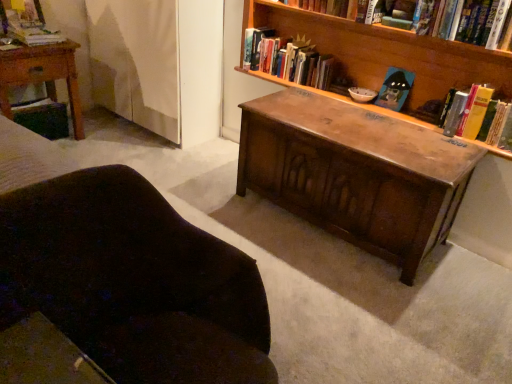
Question: Considering the relative sizes of yellow paperback book at right, the first book when ordered from right to left, and yellow hardcover book at right, the 5th book positioned from the left, in the image provided, is yellow paperback book at right, the first book when ordered from right to left, thinner than yellow hardcover book at right, the 5th book positioned from the left,?

Choices:
 (A) no
 (B) yes

Answer: (B)

Question: Is yellow paperback book at right, the first book when ordered from right to left, surrounding yellow hardcover book at right, the 5th book positioned from the left?

Choices:
 (A) yes
 (B) no

Answer: (B)

Question: Considering the relative positions of yellow paperback book at right, the first book when ordered from right to left, and yellow hardcover book at right, the 5th book positioned from the left, in the image provided, is yellow paperback book at right, the first book when ordered from right to left, to the left of yellow hardcover book at right, the 5th book positioned from the left, from the viewer's perspective?

Choices:
 (A) yes
 (B) no

Answer: (B)

Question: Does yellow paperback book at right, the first book when ordered from right to left, touch yellow hardcover book at right, which is counted as the second book, starting from the right?

Choices:
 (A) yes
 (B) no

Answer: (A)

Question: From a real-world perspective, is yellow paperback book at right, the 6th book positioned from the left, beneath yellow hardcover book at right, which is counted as the second book, starting from the right?

Choices:
 (A) no
 (B) yes

Answer: (A)

Question: Is wooden bookshelf at upper center, which is the 2th book in left-to-right order, inside or outside of yellow paperback book at right, the first book when ordered from right to left?

Choices:
 (A) inside
 (B) outside

Answer: (B)

Question: From a real-world perspective, is wooden bookshelf at upper center, positioned as the 5th book in right-to-left order, positioned above or below yellow paperback book at right, the 6th book positioned from the left?

Choices:
 (A) above
 (B) below

Answer: (B)

Question: Considering the positions of wooden bookshelf at upper center, positioned as the 5th book in right-to-left order, and yellow paperback book at right, the first book when ordered from right to left, in the image, is wooden bookshelf at upper center, positioned as the 5th book in right-to-left order, wider or thinner than yellow paperback book at right, the first book when ordered from right to left,?

Choices:
 (A) wide
 (B) thin

Answer: (B)

Question: Relative to yellow paperback book at right, the first book when ordered from right to left, is wooden bookshelf at upper center, which is the 2th book in left-to-right order, in front or behind?

Choices:
 (A) front
 (B) behind

Answer: (B)

Question: Considering the positions of point click(28, 23) and point click(366, 49), is point click(28, 23) closer or farther from the camera than point click(366, 49)?

Choices:
 (A) farther
 (B) closer

Answer: (A)

Question: Relative to wooden bookcase at center, is hardcover book at upper left, the 6th book positioned from the right, in front or behind?

Choices:
 (A) front
 (B) behind

Answer: (B)

Question: Is hardcover book at upper left, the 6th book positioned from the right, wider or thinner than wooden bookcase at center?

Choices:
 (A) thin
 (B) wide

Answer: (A)

Question: In terms of height, does hardcover book at upper left, which ranks as the 1th book in left-to-right order, look taller or shorter compared to wooden bookcase at center?

Choices:
 (A) short
 (B) tall

Answer: (A)

Question: Based on their sizes in the image, would you say hardcover book at upper left, which ranks as the 1th book in left-to-right order, is bigger or smaller than shiny brown wooden chest at center?

Choices:
 (A) small
 (B) big

Answer: (A)

Question: From a real-world perspective, is hardcover book at upper left, which ranks as the 1th book in left-to-right order, above or below shiny brown wooden chest at center?

Choices:
 (A) above
 (B) below

Answer: (A)